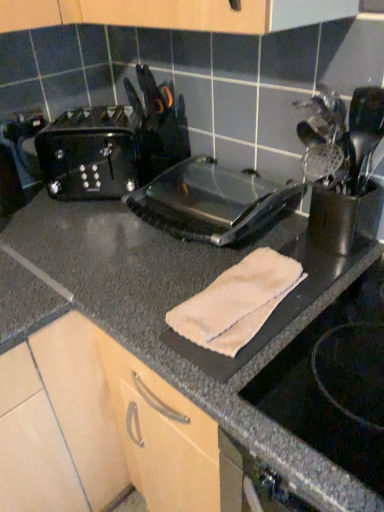
Locate an element on the screen. The width and height of the screenshot is (384, 512). free space above granite black countertop at center (from a real-world perspective) is located at coordinates (162, 256).